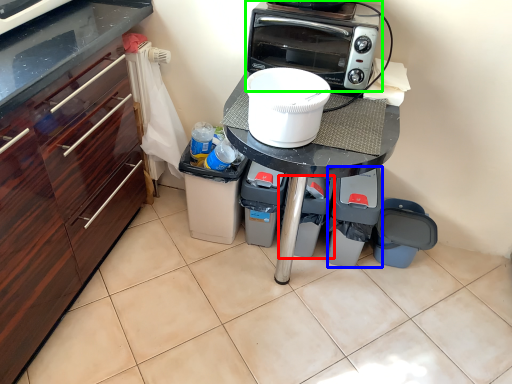
Question: Which object is the farthest from appliance (highlighted by a red box)? Choose among these: appliance (highlighted by a blue box) or kitchen appliance (highlighted by a green box).

Choices:
 (A) appliance
 (B) kitchen appliance

Answer: (B)